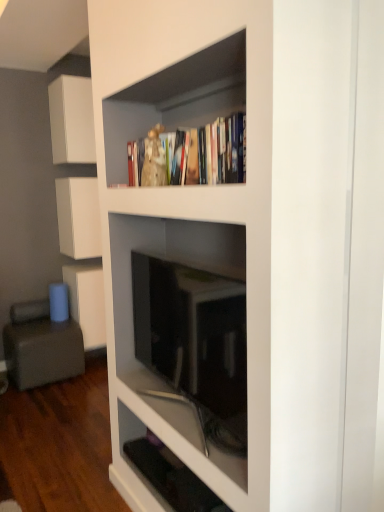
This screenshot has height=512, width=384. I want to click on vacant space underneath matte black tv at center, marked as the 2th shelf in a bottom-to-top arrangement (from a real-world perspective), so click(x=178, y=415).